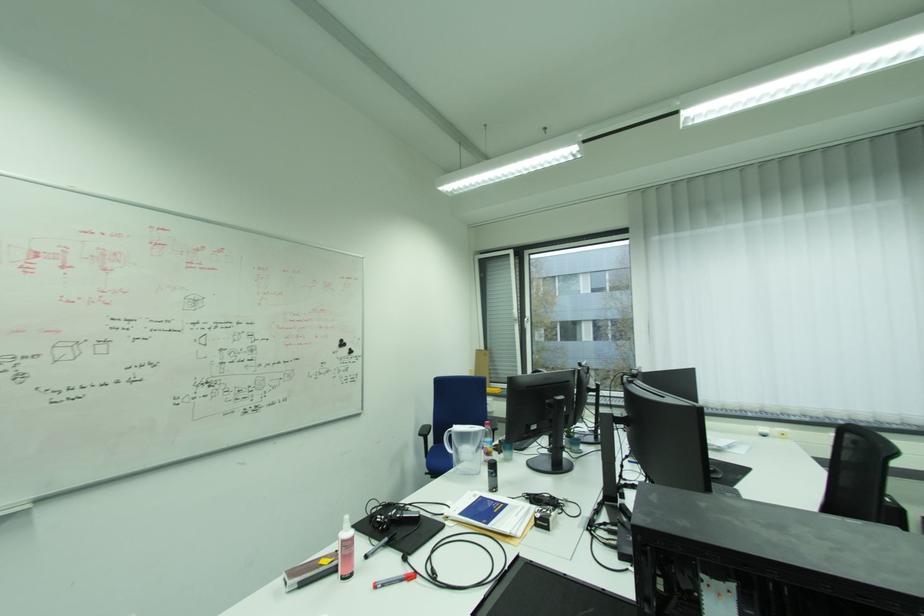
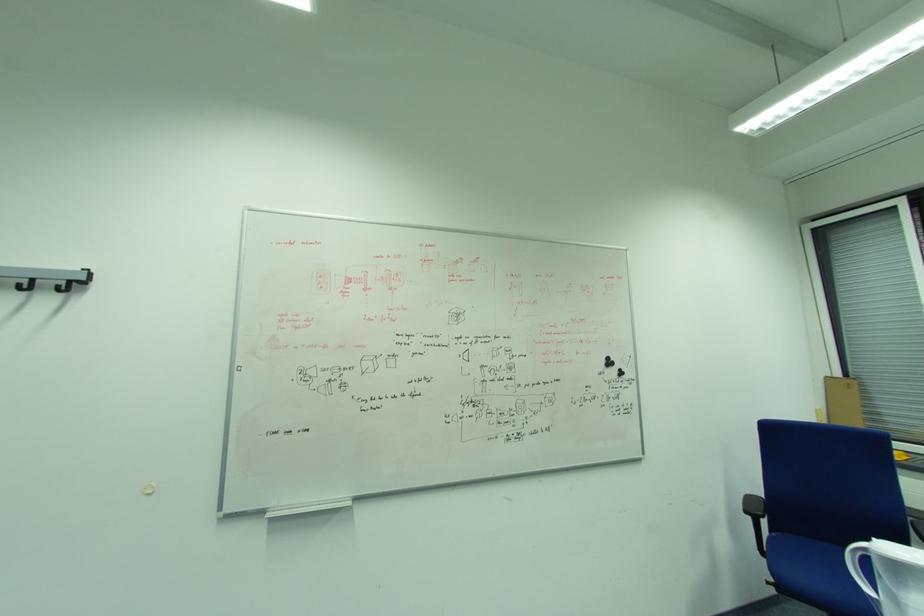
In the second image, find the point that corresponds to pixel 457 451 in the first image.

(876, 591)